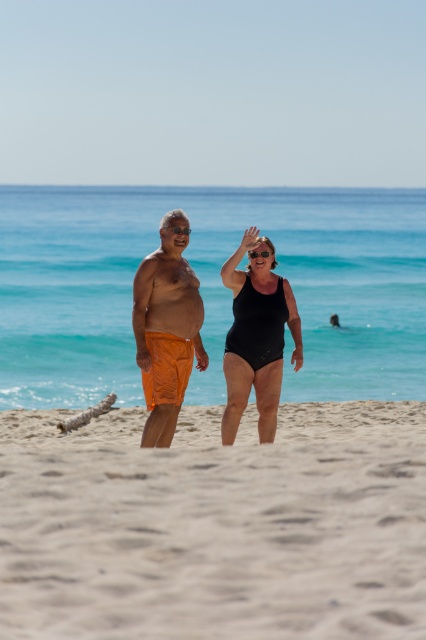
Question: Which point is farther to the camera?

Choices:
 (A) (175, 228)
 (B) (394, 614)
 (C) (253, 291)
 (D) (140, 282)

Answer: (C)

Question: In this image, where is orange fabric shorts at center located relative to clear plastic goggles at center?

Choices:
 (A) right
 (B) left

Answer: (B)

Question: Which object appears closest to the camera in this image?

Choices:
 (A) smooth sand at center
 (B) orange fabric shorts at center
 (C) clear plastic goggles at center

Answer: (B)

Question: Is orange fabric shorts at left to the left of transparent plastic goggles at center from the viewer's perspective?

Choices:
 (A) no
 (B) yes

Answer: (B)

Question: Considering the real-world distances, which object is closest to the transparent plastic goggles at center?

Choices:
 (A) orange fabric shorts at center
 (B) clear plastic goggles at center
 (C) black matte swimsuit at center
 (D) smooth sand at center

Answer: (B)

Question: Can you confirm if smooth sand at center is positioned to the right of orange fabric shorts at center?

Choices:
 (A) no
 (B) yes

Answer: (B)